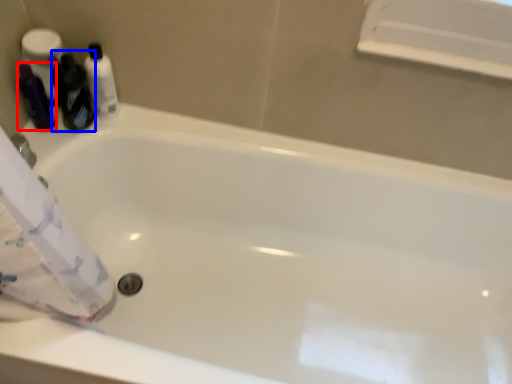
Question: Which of the following is the closest to the observer, toiletry (highlighted by a red box) or cleaning product (highlighted by a blue box)?

Choices:
 (A) toiletry
 (B) cleaning product

Answer: (B)